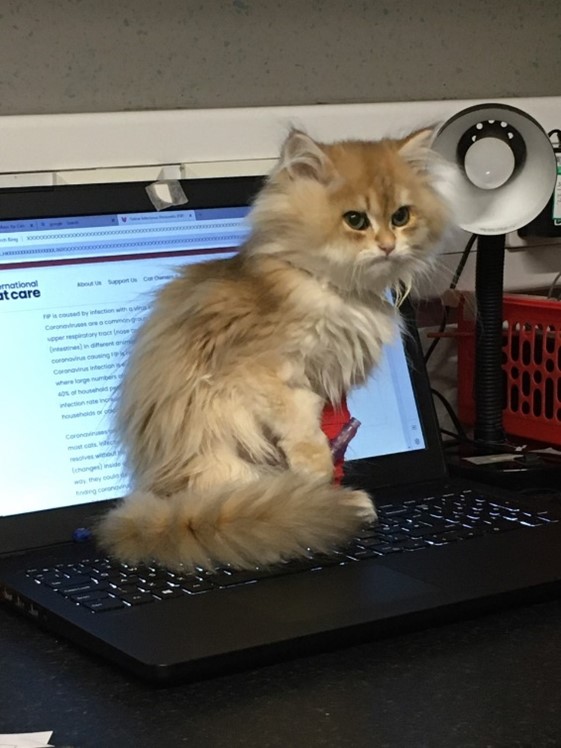
The height and width of the screenshot is (748, 561). I want to click on desklamp, so click(x=496, y=217).